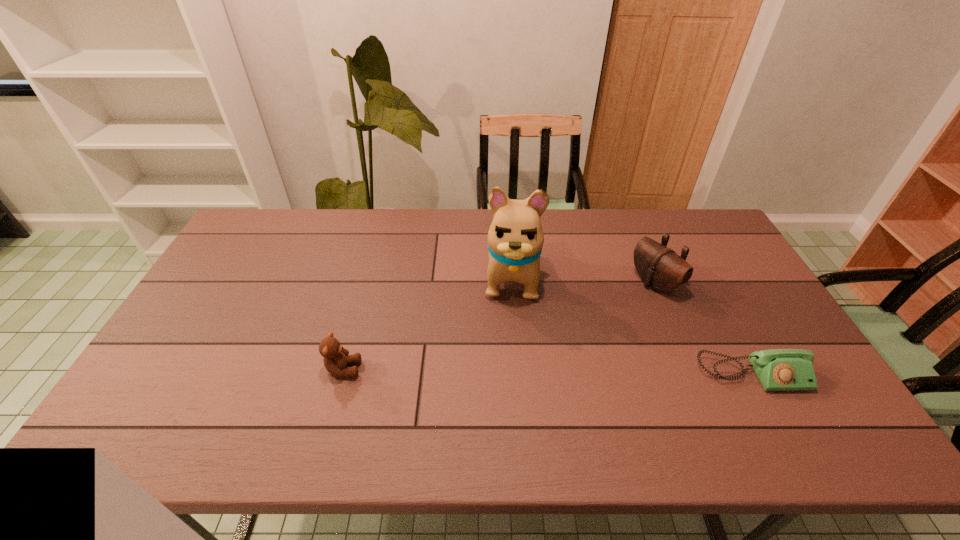
The width and height of the screenshot is (960, 540). What are the coordinates of `free space located with the flap open on the pouch` in the screenshot? It's located at (551, 342).

Where is `vacant region located 0.210m with the flap open on the pouch`? This screenshot has height=540, width=960. vacant region located 0.210m with the flap open on the pouch is located at coordinates (589, 322).

This screenshot has height=540, width=960. What are the coordinates of `vacant space located 0.190m with the flap open on the pouch` in the screenshot? It's located at (594, 319).

Identify the location of object present at the far edge. The height and width of the screenshot is (540, 960). (515, 238).

Where is `teddy bear that is positioned at the near edge`? This screenshot has height=540, width=960. teddy bear that is positioned at the near edge is located at coordinates (336, 358).

This screenshot has height=540, width=960. I want to click on telephone at the near edge, so click(x=777, y=369).

Identify the location of object located in the right edge section of the desktop. (777, 369).

Locate an element on the screen. This screenshot has height=540, width=960. object at the near right corner is located at coordinates (777, 369).

In the image, there is a desktop. Where is `vacant space at the far edge`? vacant space at the far edge is located at coordinates (324, 215).

Identify the location of vacant area at the near edge. (706, 380).